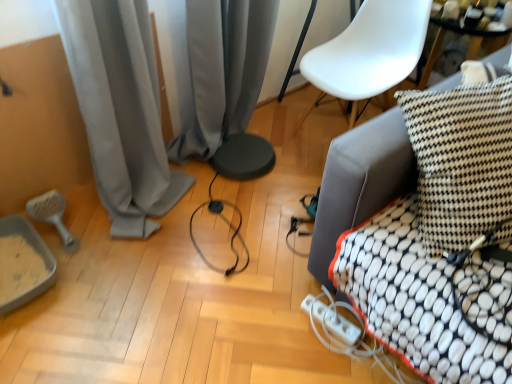
Find the location of a particular element. This screenshot has width=512, height=384. free location in front of gray fabric curtain at lower left, marked as the 1th curtain in a left-to-right arrangement is located at coordinates (125, 299).